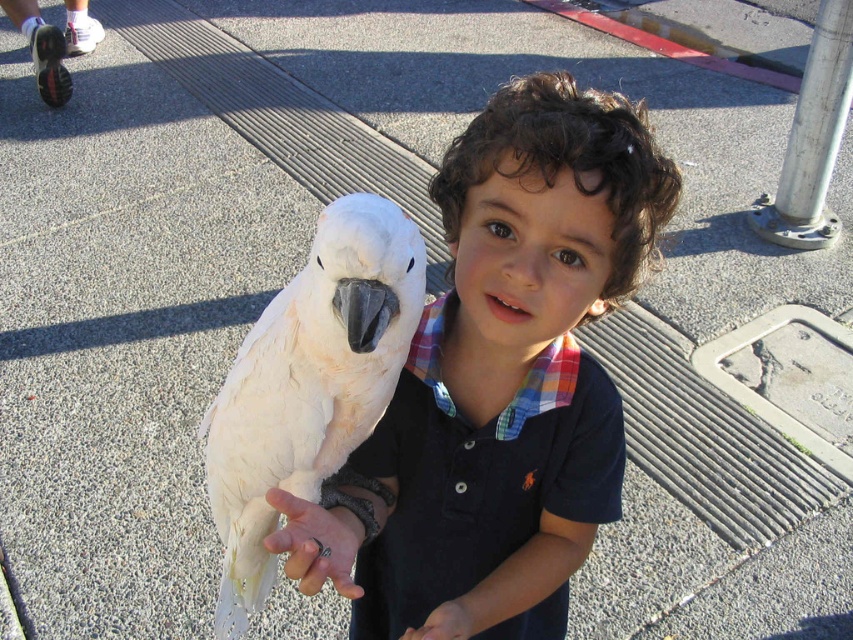
You are a photographer trying to capture a closeup of the white matte hand at center and the white matte hand at lower center. Which hand should you focus on first if you want to start with the one closer to the camera?

The white matte hand at lower center is closer to the camera than the white matte hand at center, so you should focus on the white matte hand at lower center first.